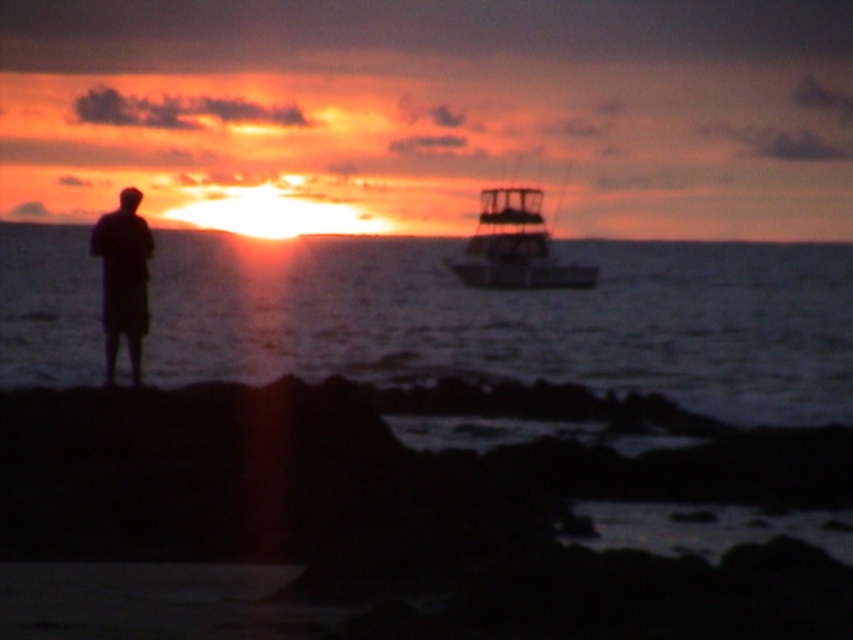
Is point (473, 248) more distant than point (134, 244)?

Yes, it is.

Does metallic silver boat at upper right have a greater width compared to black matte figure at left?

Yes.

The width and height of the screenshot is (853, 640). In order to click on metallic silver boat at upper right in this screenshot , I will do `click(514, 246)`.

Locate an element on the screen. metallic silver boat at upper right is located at coordinates (514, 246).